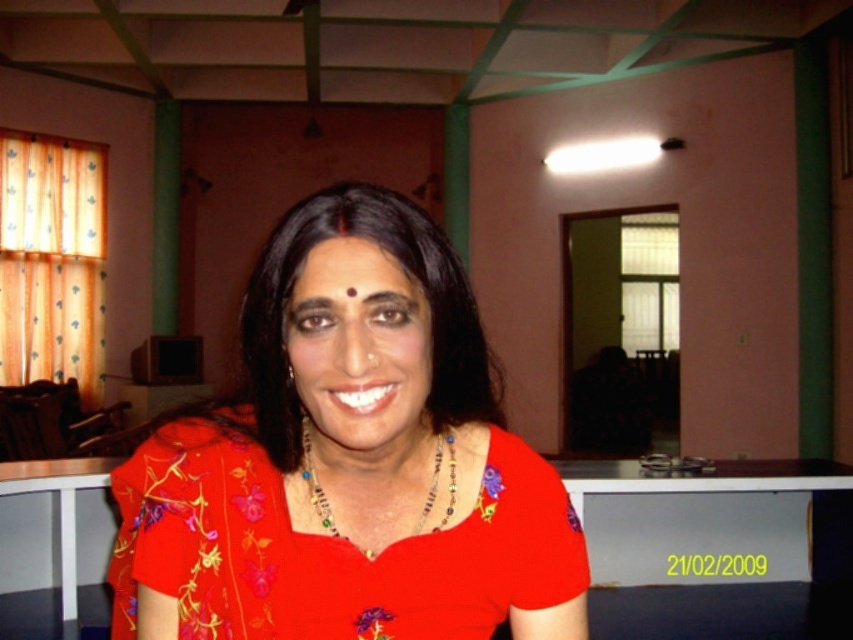
You are a photographer adjusting your camera settings to capture the woman in the scene. You need to ensure both the matte floral dress at center and the matte red forehead at center are in focus. Given that your camera can only focus on objects within a 5.5 inch range, will both elements be in focus?

The distance between the matte floral dress at center and the matte red forehead at center is 6.00 inches, which exceeds the camera focus range of 5.5 inches. Therefore, both elements cannot be in focus simultaneously.

The woman in the image is wearing a matte red forehead at center and a beaded necklace at center. Which of these two items is positioned higher on her body?

The matte red forehead at center is located above the beaded necklace at center, so it is positioned higher on her body.

You are a photographer adjusting your camera settings to capture the woman in the scene. You notice the matte floral dress at center and the matte red forehead at center. Which object is located lower in the image?

The matte floral dress at center is positioned under the matte red forehead at center, so the dress is lower than the forehead.